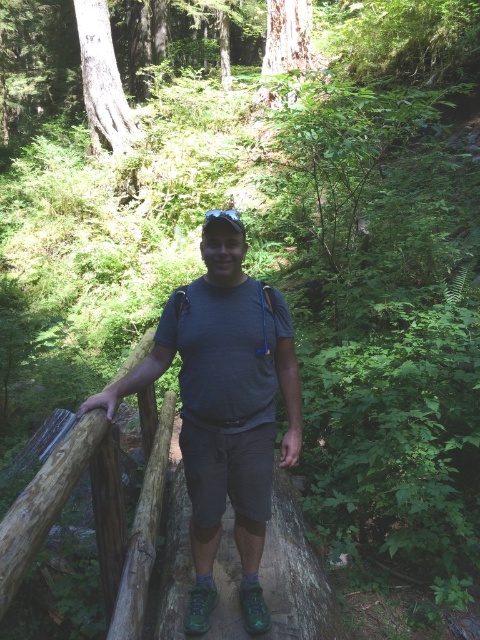
Between brown rough wood at left and green rubber shoes at center, which one is positioned lower?

green rubber shoes at center

Which of these two, brown rough wood at left or green rubber shoes at center, stands shorter?

green rubber shoes at center

Is point (16, 497) positioned behind point (222, 600)?

No.

The width and height of the screenshot is (480, 640). Identify the location of brown rough wood at left. (94, 509).

Which is more to the left, gray matte t-shirt at center or green rubber shoes at center?

gray matte t-shirt at center

Does gray matte t-shirt at center appear on the left side of green rubber shoes at center?

Indeed, gray matte t-shirt at center is positioned on the left side of green rubber shoes at center.

Does point (195, 291) lie in front of point (216, 577)?

That is True.

Locate an element on the screen. This screenshot has width=480, height=640. gray matte t-shirt at center is located at coordinates (225, 406).

Is gray matte t-shirt at center to the left of brown rough wood at left from the viewer's perspective?

No, gray matte t-shirt at center is not to the left of brown rough wood at left.

From the picture: Does gray matte t-shirt at center have a lesser height compared to brown rough wood at left?

No.

Does point (237, 362) lie in front of point (165, 465)?

Yes, point (237, 362) is in front of point (165, 465).

This screenshot has width=480, height=640. I want to click on gray matte t-shirt at center, so click(x=225, y=406).